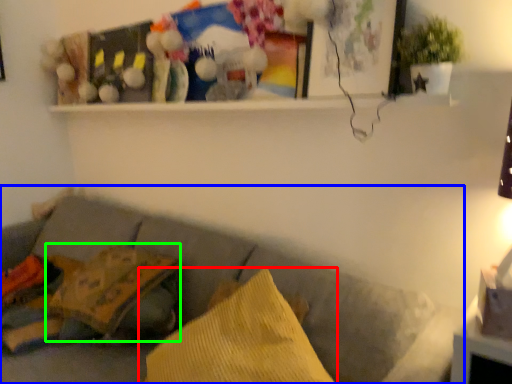
Question: Considering the real-world distances, which object is closest to pillow (highlighted by a red box)? studio couch (highlighted by a blue box) or pillow (highlighted by a green box).

Choices:
 (A) studio couch
 (B) pillow

Answer: (A)